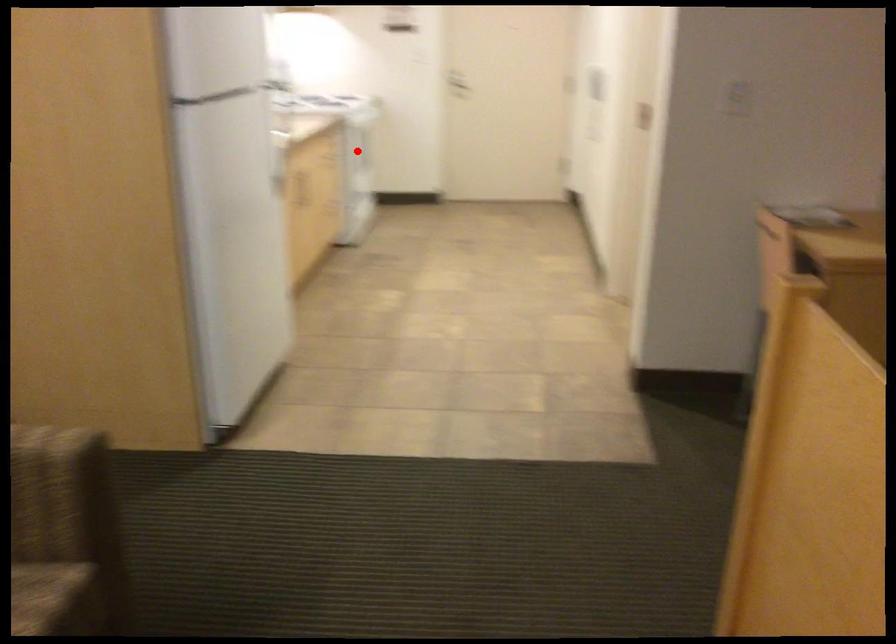
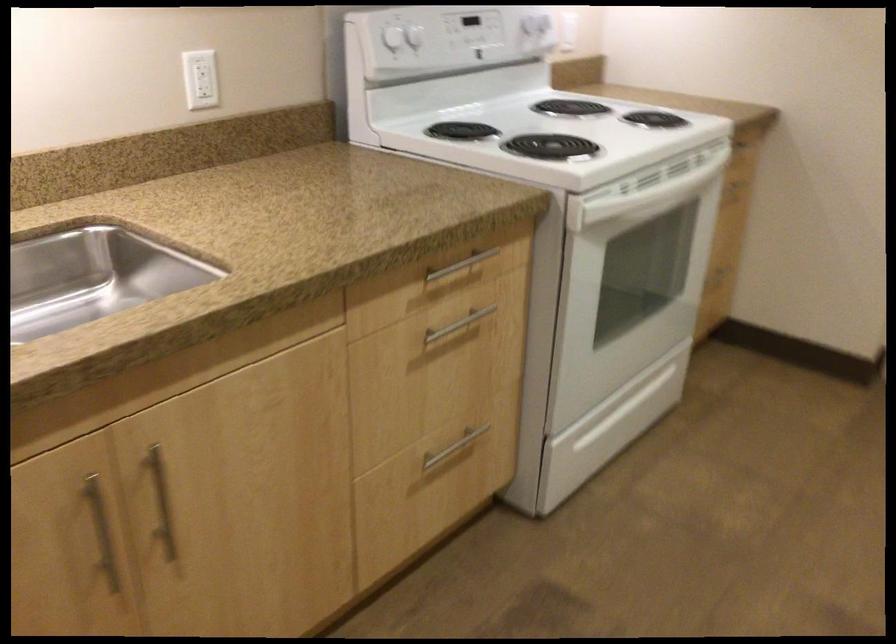
The point at the highlighted location is marked in the first image. Where is the corresponding point in the second image?

(457, 325)